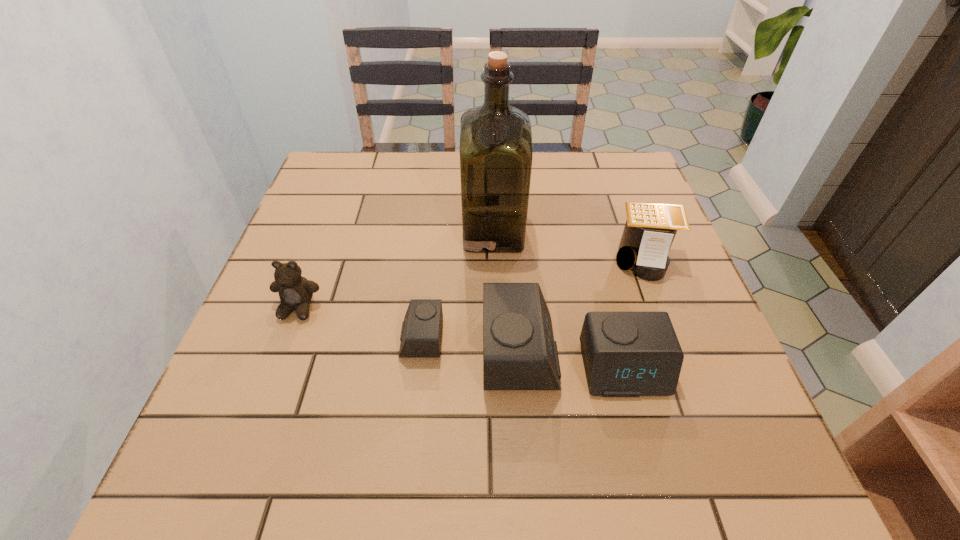
You are a GUI agent. You are given a task and a screenshot of the screen. Output one action in this format:
    pyautogui.click(x=<x>, y=<y>)
    Task: Click on the calculator located in the right edge section of the desktop
    The image size is (960, 540).
    Given the screenshot: What is the action you would take?
    pyautogui.click(x=650, y=228)

Find the location of a particular element. Image resolution: width=960 pixels, height=540 pixels. object that is at the near right corner is located at coordinates (626, 354).

Find the location of a particular element. The image size is (960, 540). free space at the far edge of the desktop is located at coordinates (578, 192).

Where is `vacant region at the near edge of the desktop`? vacant region at the near edge of the desktop is located at coordinates (320, 396).

I want to click on vacant region at the left edge of the desktop, so click(283, 354).

Where is `vacant space at the right edge of the desktop`? vacant space at the right edge of the desktop is located at coordinates (694, 367).

Identify the location of vacant area at the far left corner of the desktop. This screenshot has width=960, height=540. (335, 185).

Where is `vacant point at the far right corner`? The image size is (960, 540). vacant point at the far right corner is located at coordinates (607, 172).

You are a GUI agent. You are given a task and a screenshot of the screen. Output one action in this format:
    pyautogui.click(x=<x>, y=<y>)
    Task: Click on the free space at the near right corner of the desktop
    Image resolution: width=960 pixels, height=540 pixels.
    Given the screenshot: What is the action you would take?
    pyautogui.click(x=700, y=424)

Where is `free space between the rightmost alarm clock and the second alarm clock from left to right`? free space between the rightmost alarm clock and the second alarm clock from left to right is located at coordinates (572, 361).